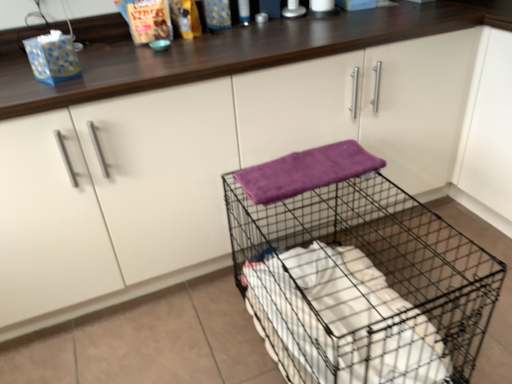
Question: Visually, is purple soft towel at center positioned to the left or to the right of black wire mesh trolley at center?

Choices:
 (A) right
 (B) left

Answer: (B)

Question: In terms of size, does purple soft towel at center appear bigger or smaller than black wire mesh trolley at center?

Choices:
 (A) small
 (B) big

Answer: (A)

Question: Would you say purple soft towel at center is inside or outside black wire mesh trolley at center?

Choices:
 (A) outside
 (B) inside

Answer: (A)

Question: Based on their positions, is black wire mesh trolley at center located to the left or right of purple soft towel at center?

Choices:
 (A) left
 (B) right

Answer: (B)

Question: Is black wire mesh trolley at center taller or shorter than purple soft towel at center?

Choices:
 (A) tall
 (B) short

Answer: (A)

Question: Is black wire mesh trolley at center inside or outside of purple soft towel at center?

Choices:
 (A) inside
 (B) outside

Answer: (B)

Question: From the image's perspective, is black wire mesh trolley at center located above or below purple soft towel at center?

Choices:
 (A) below
 (B) above

Answer: (A)